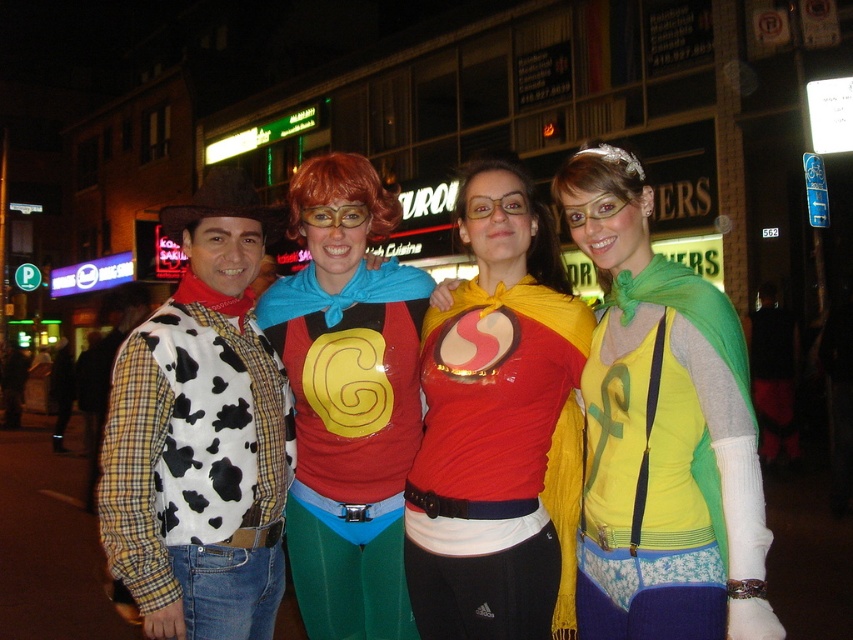
Question: Which of these objects is positioned farthest from the yellow-green jersey at center?

Choices:
 (A) shiny red cape at center
 (B) rubberized red and yellow shirt at center

Answer: (B)

Question: Does shiny red cape at center have a lesser width compared to rubberized red and yellow shirt at center?

Choices:
 (A) yes
 (B) no

Answer: (A)

Question: Is shiny red cape at center thinner than cow print vest at center?

Choices:
 (A) yes
 (B) no

Answer: (B)

Question: Which of these objects is positioned farthest from the yellow-green jersey at center?

Choices:
 (A) rubberized red and yellow shirt at center
 (B) shiny red cape at center
 (C) cow print vest at center

Answer: (C)

Question: Among these objects, which one is nearest to the camera?

Choices:
 (A) rubberized red and yellow shirt at center
 (B) yellow-green jersey at center

Answer: (B)

Question: Is yellow-green jersey at center below cow print vest at center?

Choices:
 (A) yes
 (B) no

Answer: (B)